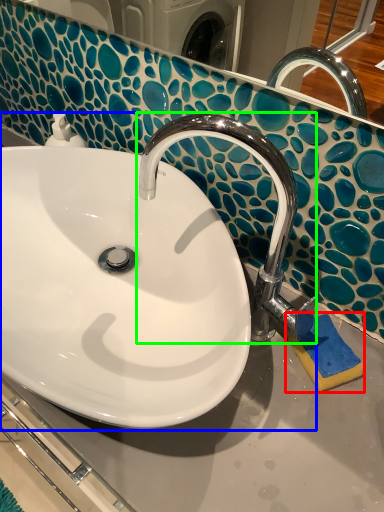
Question: Estimate the real-world distances between objects in this image. Which object is farther from soap (highlighted by a red box), sink (highlighted by a blue box) or tap (highlighted by a green box)?

Choices:
 (A) sink
 (B) tap

Answer: (A)